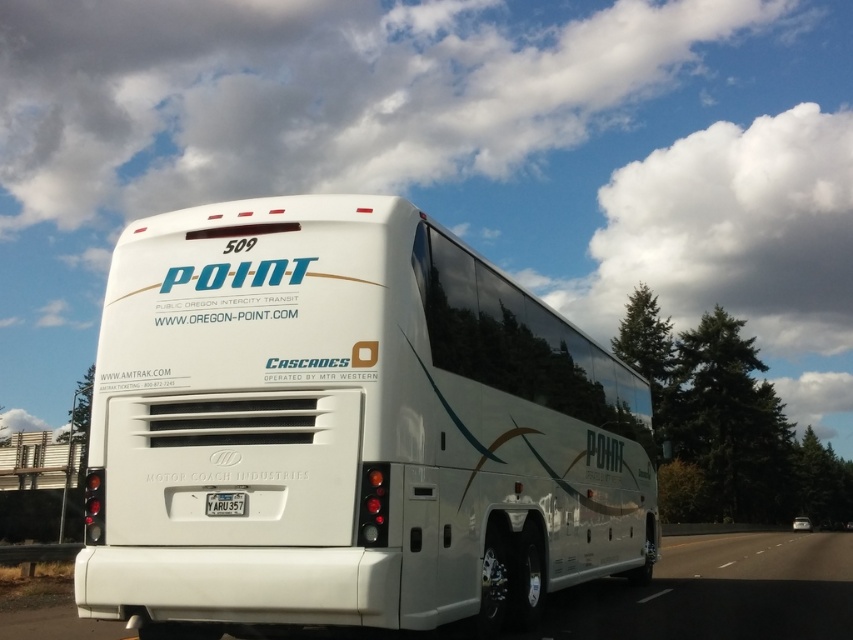
Locate an element on the screen. white glossy bus at center is located at coordinates (347, 428).

Does white glossy bus at center appear on the left side of yellow matte license plate at center?

In fact, white glossy bus at center is to the right of yellow matte license plate at center.

Between point (148, 612) and point (227, 512), which one is positioned in front?

Point (227, 512) is more forward.

In order to click on white glossy bus at center in this screenshot , I will do pos(347,428).

Who is lower down, white glossy highway at lower right or yellow matte license plate at center?

white glossy highway at lower right

Does white glossy highway at lower right come behind yellow matte license plate at center?

No, white glossy highway at lower right is in front of yellow matte license plate at center.

Between point (830, 620) and point (230, 508), which one is positioned behind?

Positioned behind is point (830, 620).

Locate an element on the screen. This screenshot has width=853, height=640. white glossy highway at lower right is located at coordinates click(718, 593).

Describe the element at coordinates (347, 428) in the screenshot. This screenshot has width=853, height=640. I see `white glossy bus at center` at that location.

Which is below, white glossy bus at center or white glossy highway at lower right?

Positioned lower is white glossy highway at lower right.

Locate an element on the screen. This screenshot has height=640, width=853. white glossy bus at center is located at coordinates (347, 428).